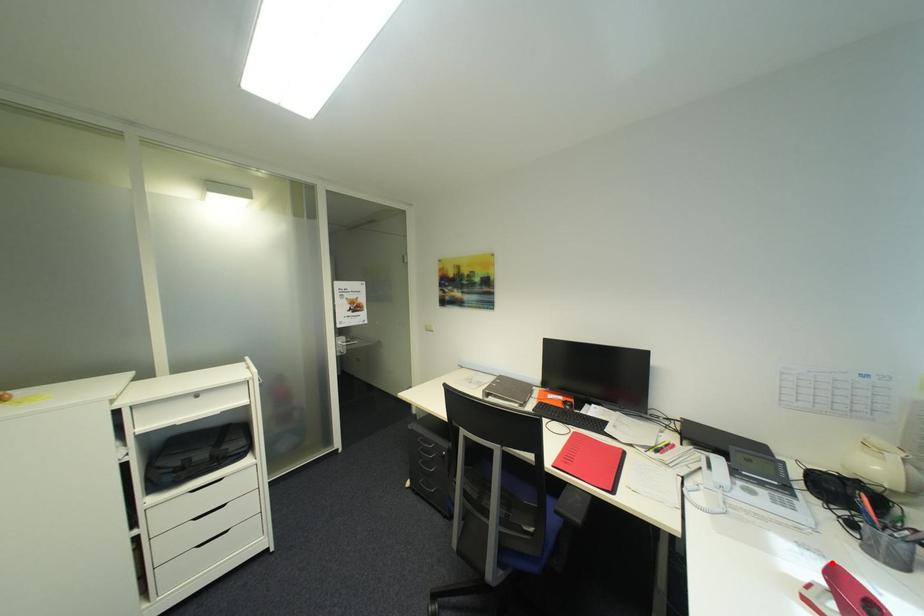
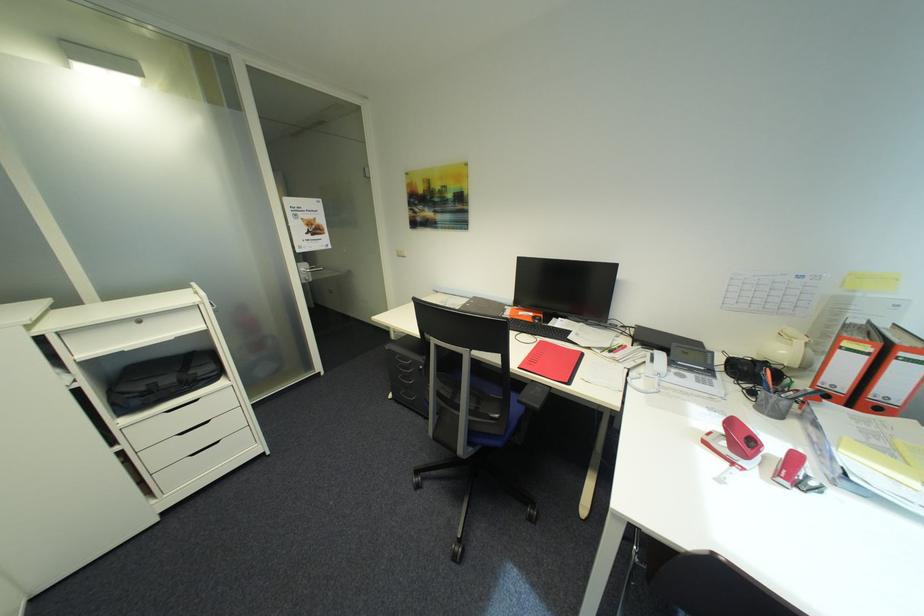
The point at the highlighted location is marked in the first image. Where is the corresponding point in the second image?

(733, 419)